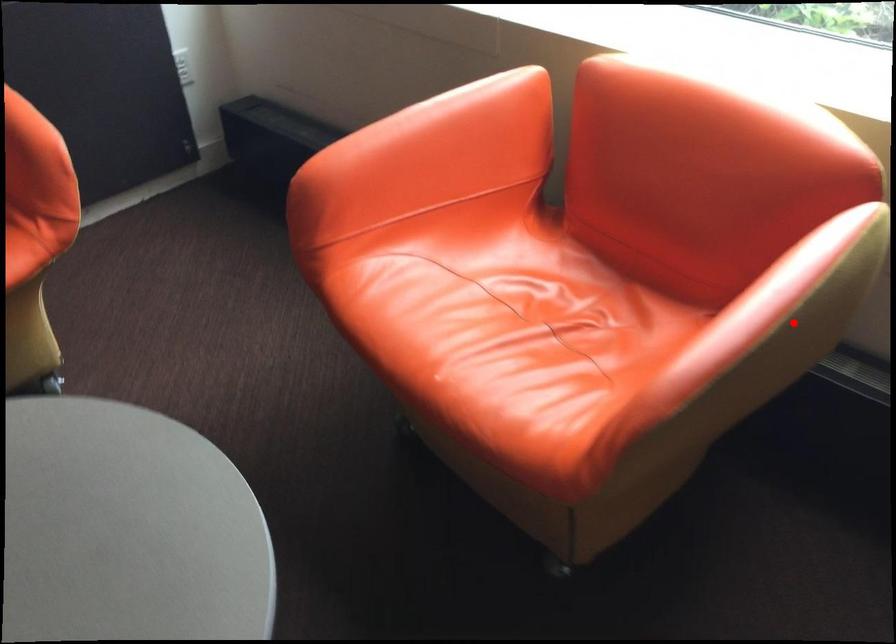
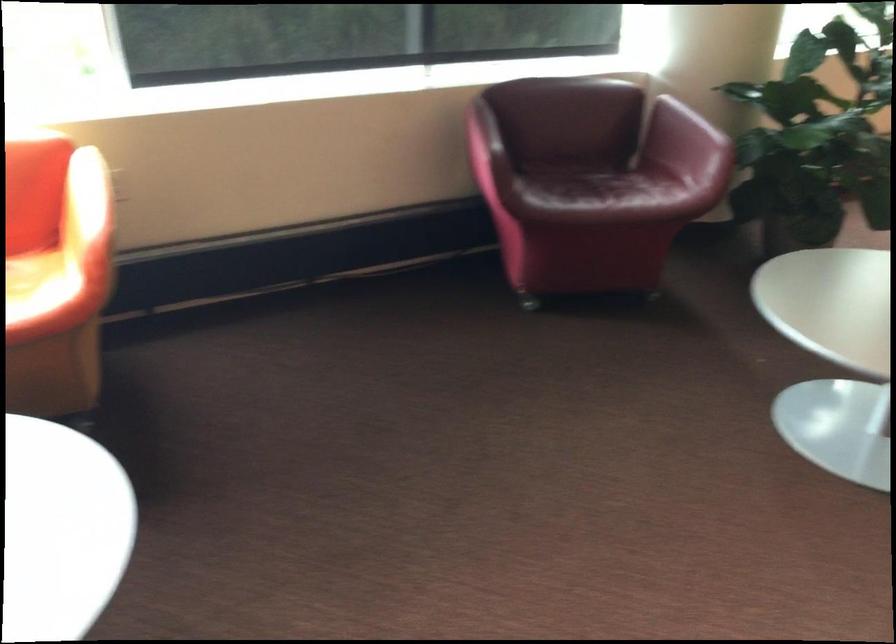
Question: I am providing you with two images of the same scene from different viewpoints. A red point is shown in image1. For the corresponding object point in image2, is it positioned nearer or farther from the camera?

Choices:
 (A) Nearer
 (B) Farther

Answer: (B)